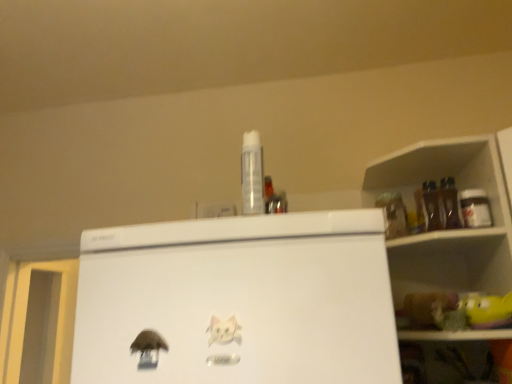
Question: Can you confirm if white paper cat at center is positioned to the left of transparent plastic spray can at center, the 2th bottle positioned from the back?

Choices:
 (A) no
 (B) yes

Answer: (B)

Question: Is white paper cat at center positioned far away from transparent plastic spray can at center, which is the 1th bottle from front to back?

Choices:
 (A) no
 (B) yes

Answer: (A)

Question: Considering the relative positions of white paper cat at center and transparent plastic spray can at center, which ranks as the 2th bottle in right-to-left order, in the image provided, is white paper cat at center behind transparent plastic spray can at center, which ranks as the 2th bottle in right-to-left order,?

Choices:
 (A) yes
 (B) no

Answer: (B)

Question: Can we say white paper cat at center lies outside transparent plastic spray can at center, which is the 1th bottle from front to back?

Choices:
 (A) yes
 (B) no

Answer: (A)

Question: Does white paper cat at center have a greater height compared to transparent plastic spray can at center, which ranks as the 2th bottle in right-to-left order?

Choices:
 (A) no
 (B) yes

Answer: (A)

Question: Is white paper cat at center closer to camera compared to transparent plastic spray can at center, which ranks as the 1th bottle in left-to-right order?

Choices:
 (A) no
 (B) yes

Answer: (B)

Question: Does metallic silver jar at upper right, acting as the first bottle starting from the back, have a smaller size compared to white paper cat at center?

Choices:
 (A) no
 (B) yes

Answer: (A)

Question: Is metallic silver jar at upper right, which appears as the 2th bottle when viewed from the front, thinner than white paper cat at center?

Choices:
 (A) no
 (B) yes

Answer: (A)

Question: From a real-world perspective, is metallic silver jar at upper right, marked as the second bottle in a left-to-right arrangement, physically above white paper cat at center?

Choices:
 (A) yes
 (B) no

Answer: (A)

Question: Are metallic silver jar at upper right, marked as the second bottle in a left-to-right arrangement, and white paper cat at center making contact?

Choices:
 (A) yes
 (B) no

Answer: (B)

Question: Is metallic silver jar at upper right, which appears as the 2th bottle when viewed from the front, taller than white paper cat at center?

Choices:
 (A) no
 (B) yes

Answer: (B)

Question: Can you confirm if metallic silver jar at upper right, which appears as the 2th bottle when viewed from the front, is bigger than white paper cat at center?

Choices:
 (A) yes
 (B) no

Answer: (A)

Question: Is transparent plastic spray can at center, which ranks as the 2th bottle in right-to-left order, surrounding white paper cat at center?

Choices:
 (A) no
 (B) yes

Answer: (A)